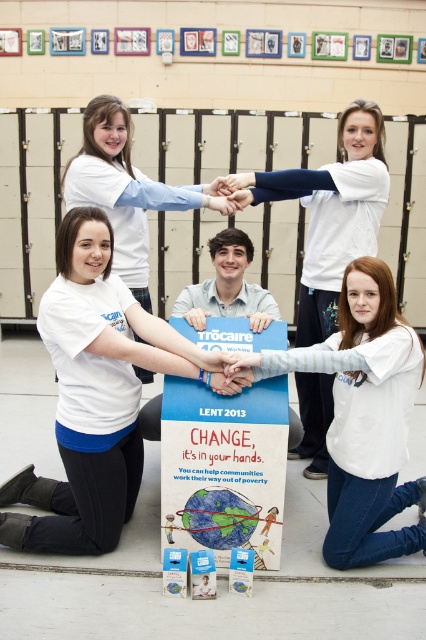
Can you confirm if white matte t-shirt at lower left is positioned below white matte t-shirt at upper center?

Indeed, white matte t-shirt at lower left is positioned under white matte t-shirt at upper center.

Is point (86, 221) closer to viewer compared to point (124, 260)?

Yes, it is.

Does point (115, 460) come closer to viewer compared to point (150, 196)?

That is True.

Locate an element on the screen. This screenshot has width=426, height=640. white matte t-shirt at lower left is located at coordinates (94, 396).

Locate an element on the screen. white matte t-shirt at lower right is located at coordinates (363, 417).

Who is more distant from viewer, (340, 368) or (302, 326)?

The point (302, 326) is behind.

What do you see at coordinates (363, 417) in the screenshot? I see `white matte t-shirt at lower right` at bounding box center [363, 417].

Where is `white matte t-shirt at lower right`? white matte t-shirt at lower right is located at coordinates (363, 417).

Does point (31, 467) come closer to viewer compared to point (337, 497)?

No, it is not.

Is the position of white matte t-shirt at lower left less distant than that of white matte t-shirt at lower right?

No, white matte t-shirt at lower left is behind white matte t-shirt at lower right.

Is point (138, 342) positioned before point (377, 560)?

Yes, point (138, 342) is closer to viewer.

Find the location of a particular element. white matte t-shirt at lower left is located at coordinates (94, 396).